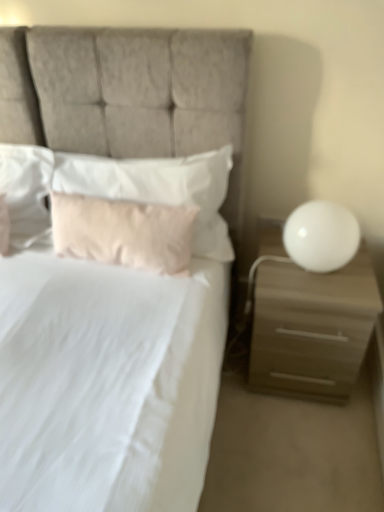
The width and height of the screenshot is (384, 512). Identify the location of vacant region in front of matte beige nightstand at right. (300, 451).